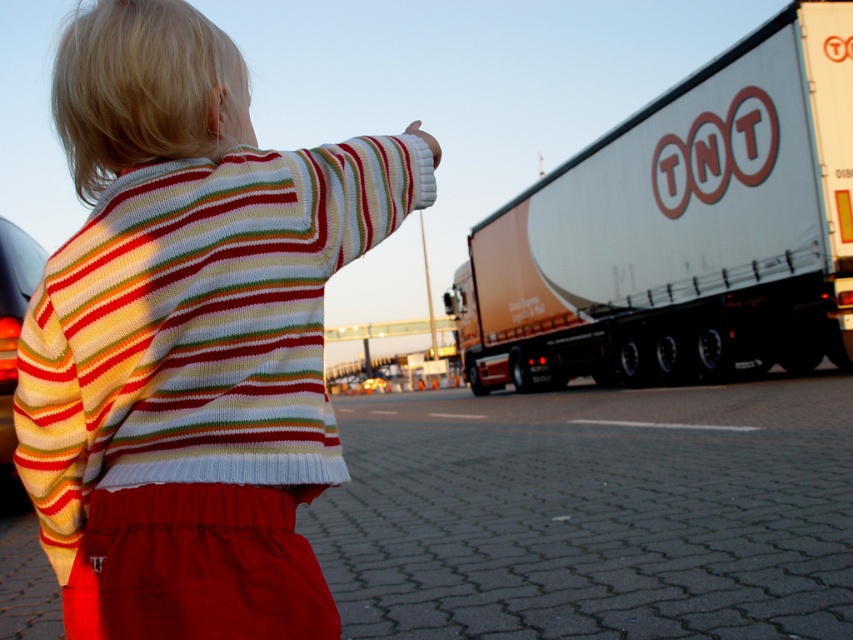
Which is in front, point (180, 102) or point (595, 284)?

Point (180, 102) is in front.

Does knitted sweater at upper left appear over white glossy trailer at right?

Incorrect, knitted sweater at upper left is not positioned above white glossy trailer at right.

The width and height of the screenshot is (853, 640). Identify the location of knitted sweater at upper left. (190, 336).